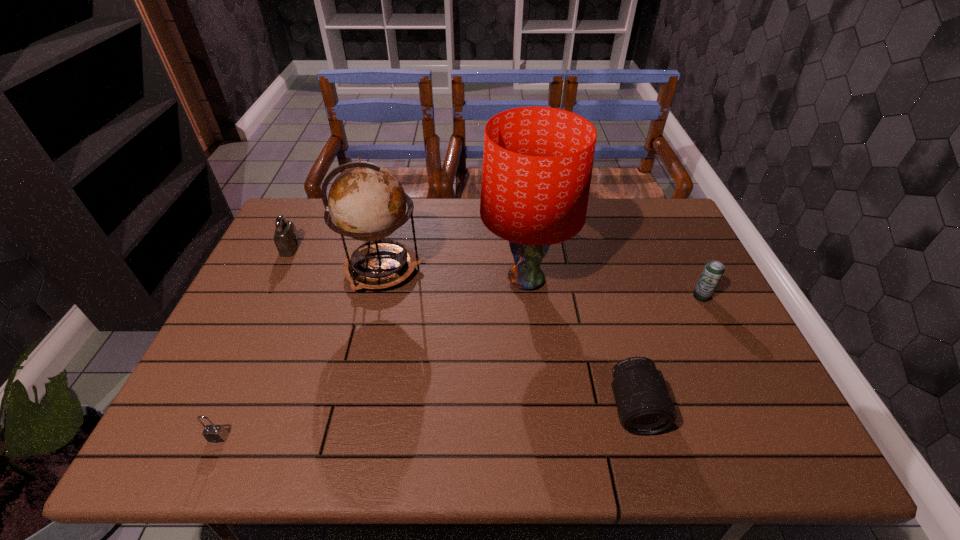
This screenshot has height=540, width=960. What are the coordinates of `free space located 0.220m at the center of the fifth shortest object` in the screenshot? It's located at (497, 269).

In order to click on vacant area located 0.150m at the front of the taller padlock near the keyhole in this screenshot , I will do `click(347, 248)`.

I want to click on free location located on the left of the beer can, so [564, 296].

The image size is (960, 540). In order to click on object that is at the far edge in this screenshot , I will do `click(286, 238)`.

Where is `telephoto lens that is at the near edge`? The height and width of the screenshot is (540, 960). telephoto lens that is at the near edge is located at coordinates (644, 406).

At what (x,y) coordinates should I click in order to perform the action: click on padlock that is at the near edge. Please return your answer as a coordinate pair (x, y). The width and height of the screenshot is (960, 540). Looking at the image, I should click on (212, 433).

Identify the location of object located in the right edge section of the desktop. This screenshot has width=960, height=540. (713, 271).

Identify the location of object that is at the far left corner. tap(286, 238).

You are a GUI agent. You are given a task and a screenshot of the screen. Output one action in this format:
    pyautogui.click(x=<x>, y=<y>)
    Task: Click on the object that is at the near left corner
    
    Given the screenshot: What is the action you would take?
    pyautogui.click(x=212, y=433)

Find the location of a particular element. vacant space at the far edge of the desktop is located at coordinates (422, 200).